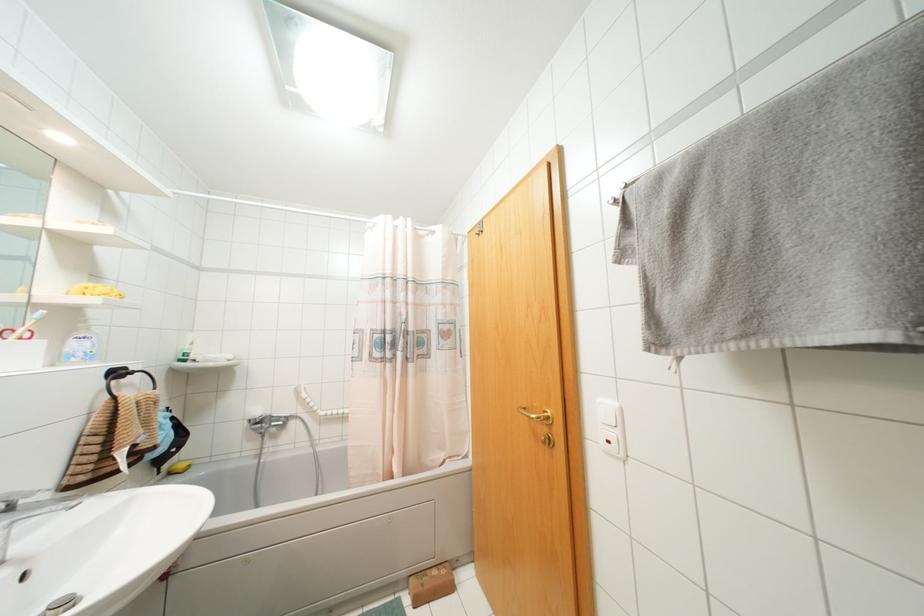
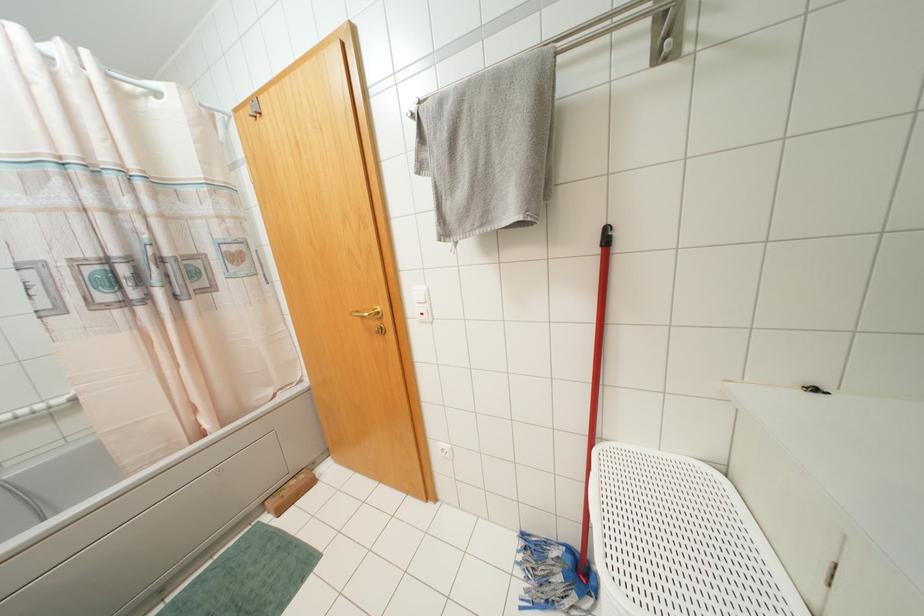
Locate, in the second image, the point that corresponds to point 546,416 in the first image.

(378, 312)